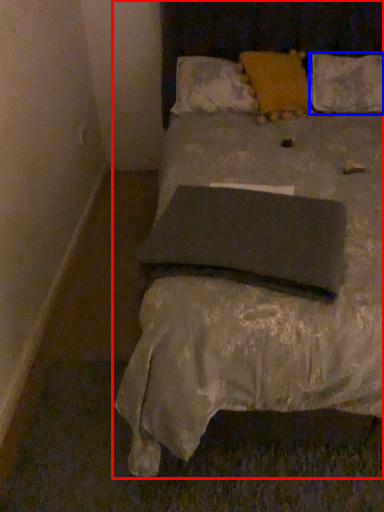
Question: Which object appears farthest to the camera in this image, bed (highlighted by a red box) or pillow (highlighted by a blue box)?

Choices:
 (A) bed
 (B) pillow

Answer: (B)